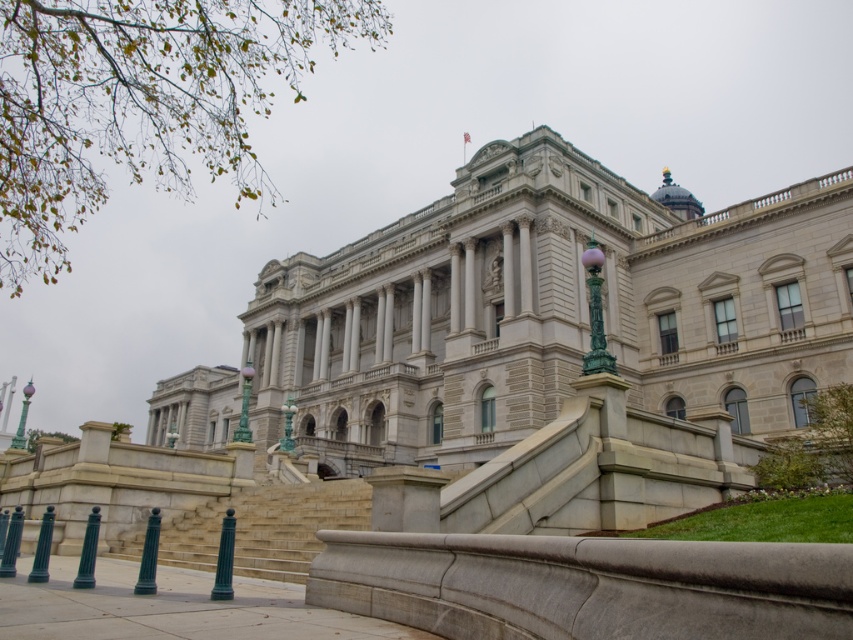
You are a delivery person needing to park your truck which is 40 feet long. You see the green polished metal pole at lower center and the green metallic pole at lower left. Is there enough space between them to park your truck?

The distance between the green polished metal pole at lower center and the green metallic pole at lower left is 40.86 feet, which is longer than the truck length of 40 feet. Therefore, the truck can be parked between them.

Consider the image. You are a visitor approaching the grand neoclassical building and notice two green poles near the entrance. Which pole, the green polished metal pole at lower center or the green metallic pole at lower left, is taller?

The green polished metal pole at lower center is taller than the green metallic pole at lower left.